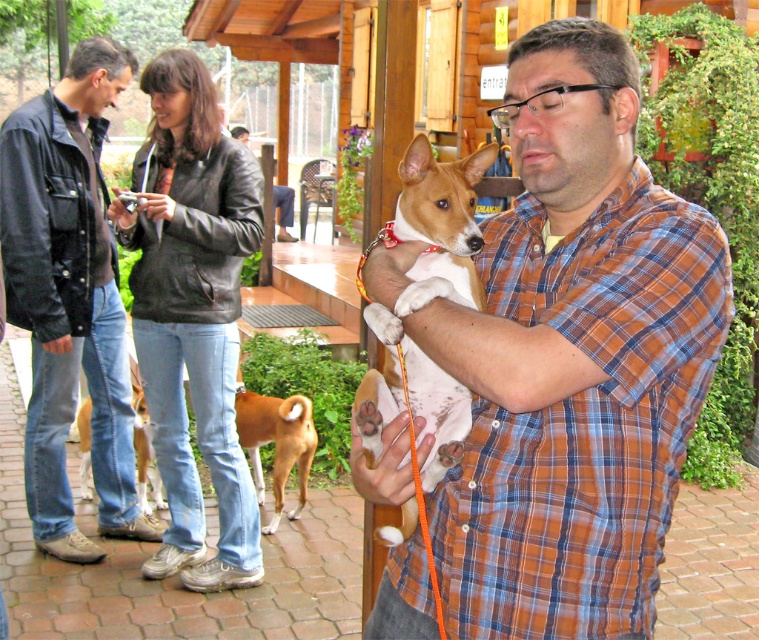
Question: Is plaid shirt at center bigger than brown fur dog at lower left?

Choices:
 (A) yes
 (B) no

Answer: (A)

Question: Considering the real-world distances, which object is farthest from the brown fur dog at lower left?

Choices:
 (A) plaid shirt at center
 (B) matte plaid shirt at center
 (C) brown furry dog at lower center

Answer: (B)

Question: Estimate the real-world distances between objects in this image. Which object is farther from the plaid shirt at center?

Choices:
 (A) matte plaid shirt at center
 (B) white fur dog at center
 (C) brown furry dog at lower center
 (D) leather jacket at left

Answer: (C)

Question: Is leather jacket at left thinner than brown furry dog at lower center?

Choices:
 (A) no
 (B) yes

Answer: (A)

Question: Which object appears farthest from the camera in this image?

Choices:
 (A) white fur dog at center
 (B) matte plaid shirt at center

Answer: (A)

Question: Is the position of matte plaid shirt at center more distant than that of brown fur dog at lower left?

Choices:
 (A) yes
 (B) no

Answer: (B)